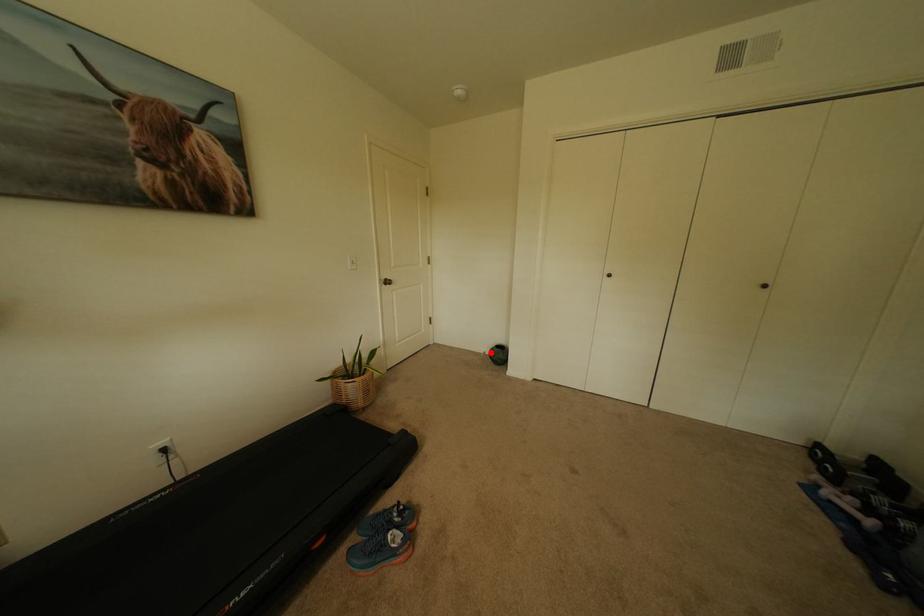
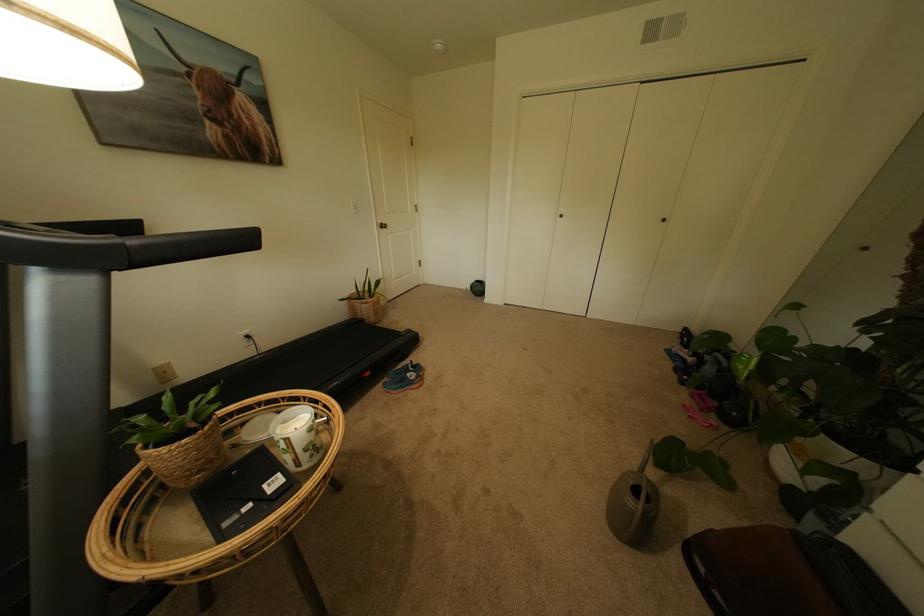
In the second image, find the point that corresponds to the highlighted location in the first image.

(473, 289)